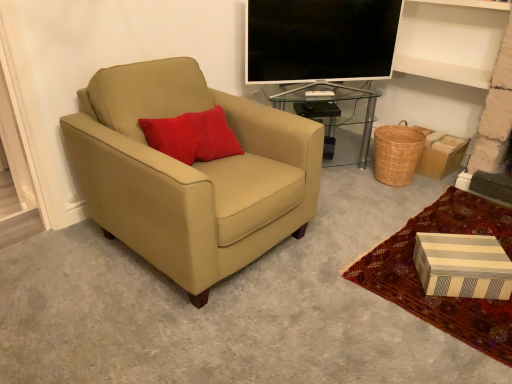
At what (x,y) coordinates should I click in order to perform the action: click on transparent glass table at center. Please return your answer as a coordinate pair (x, y). The width and height of the screenshot is (512, 384). Looking at the image, I should click on (328, 109).

What do you see at coordinates (320, 40) in the screenshot? I see `flat screen tv at upper center` at bounding box center [320, 40].

The image size is (512, 384). Find the location of `beige leather armchair at left`. beige leather armchair at left is located at coordinates (190, 173).

Can you confirm if transparent glass table at center is shorter than woven brown basket at lower right?

In fact, transparent glass table at center may be taller than woven brown basket at lower right.

Do you think transparent glass table at center is within woven brown basket at lower right, or outside of it?

transparent glass table at center is not enclosed by woven brown basket at lower right.

Considering the sizes of objects transparent glass table at center and woven brown basket at lower right in the image provided, who is smaller, transparent glass table at center or woven brown basket at lower right?

With smaller size is woven brown basket at lower right.

Looking at their sizes, would you say transparent glass table at center is wider or thinner than woven brown basket at lower right?

Considering their sizes, transparent glass table at center looks broader than woven brown basket at lower right.

Is the surface of woven brown basket at lower right in direct contact with flat screen tv at upper center?

No, woven brown basket at lower right is not with flat screen tv at upper center.

Is woven brown basket at lower right oriented away from flat screen tv at upper center?

No, woven brown basket at lower right is not facing away from flat screen tv at upper center.

Could flat screen tv at upper center be considered to be inside woven brown basket at lower right?

Actually, flat screen tv at upper center is outside woven brown basket at lower right.

What are the coordinates of `television above the striped cardboard box at lower right (from a real-world perspective)` in the screenshot? It's located at (320, 40).

From the image's perspective, between striped cardboard box at lower right and flat screen tv at upper center, who is located below?

striped cardboard box at lower right appears lower in the image.

Considering the sizes of striped cardboard box at lower right and flat screen tv at upper center in the image, is striped cardboard box at lower right wider or thinner than flat screen tv at upper center?

In the image, striped cardboard box at lower right appears to be wider than flat screen tv at upper center.

Looking at this image, is striped cardboard box at lower right positioned with its back to flat screen tv at upper center?

That's not correct — striped cardboard box at lower right is not looking away from flat screen tv at upper center.

Which object is closer to the camera, striped cardboard box at lower right or woven brown basket at lower right?

Positioned in front is striped cardboard box at lower right.

In terms of width, does striped cardboard box at lower right look wider or thinner when compared to woven brown basket at lower right?

striped cardboard box at lower right is wider than woven brown basket at lower right.

Who is smaller, striped cardboard box at lower right or woven brown basket at lower right?

woven brown basket at lower right.

Is striped cardboard box at lower right facing away from woven brown basket at lower right?

No, striped cardboard box at lower right's orientation is not away from woven brown basket at lower right.

Visually, is woven brown basket at lower right positioned to the left or to the right of striped cardboard box at lower right?

In the image, woven brown basket at lower right appears on the left side of striped cardboard box at lower right.

Which of these two, woven brown basket at lower right or striped cardboard box at lower right, is smaller?

woven brown basket at lower right is smaller.

Locate an element on the screen. The image size is (512, 384). plain located on the right of woven brown basket at lower right is located at coordinates (443, 297).

Considering the points (508, 262) and (486, 200), which point is behind, point (508, 262) or point (486, 200)?

The point (486, 200) is behind.

From the image's perspective, which object appears higher, striped cardboard box at lower right or striped cardboard box at lower right?

striped cardboard box at lower right appears higher in the image.

The width and height of the screenshot is (512, 384). Find the location of `plain on the right of striped cardboard box at lower right`. plain on the right of striped cardboard box at lower right is located at coordinates (443, 297).

Does striped cardboard box at lower right have a larger size compared to striped cardboard box at lower right?

No, striped cardboard box at lower right is not bigger than striped cardboard box at lower right.

Is woven brown basket at lower right looking in the opposite direction of transparent glass table at center?

No.

From the image's perspective, is woven brown basket at lower right located above transparent glass table at center?

No, from the image's perspective, woven brown basket at lower right is not over transparent glass table at center.

Which of these two, woven brown basket at lower right or transparent glass table at center, stands shorter?

Standing shorter between the two is woven brown basket at lower right.

This screenshot has height=384, width=512. Identify the location of table above the woven brown basket at lower right (from the image's perspective). (328, 109).

The image size is (512, 384). I want to click on basket below the flat screen tv at upper center (from the image's perspective), so click(x=397, y=153).

Which object lies further to the anchor point woven brown basket at lower right, transparent glass table at center or beige leather armchair at left?

beige leather armchair at left is positioned further to the anchor woven brown basket at lower right.

Looking at this image, from the image, which object appears to be farther from striped cardboard box at lower right, beige leather armchair at left or striped cardboard box at lower right?

Among the two, beige leather armchair at left is located further to striped cardboard box at lower right.

Which object lies further to the anchor point striped cardboard box at lower right, striped cardboard box at lower right or woven brown basket at lower right?

woven brown basket at lower right is further to striped cardboard box at lower right.

Considering their positions, is striped cardboard box at lower right positioned further to beige leather armchair at left than flat screen tv at upper center?

The object further to beige leather armchair at left is striped cardboard box at lower right.

Considering their positions, is flat screen tv at upper center positioned closer to woven brown basket at lower right than striped cardboard box at lower right?

flat screen tv at upper center is positioned closer to the anchor woven brown basket at lower right.

When comparing their distances from transparent glass table at center, does striped cardboard box at lower right or striped cardboard box at lower right seem further?

striped cardboard box at lower right lies further to transparent glass table at center than the other object.

Considering their positions, is transparent glass table at center positioned further to woven brown basket at lower right than flat screen tv at upper center?

flat screen tv at upper center lies further to woven brown basket at lower right than the other object.

From the image, which object appears to be nearer to flat screen tv at upper center, striped cardboard box at lower right or striped cardboard box at lower right?

The object closer to flat screen tv at upper center is striped cardboard box at lower right.

What are the coordinates of `basket between beige leather armchair at left and transparent glass table at center from front to back` in the screenshot? It's located at point(397,153).

Image resolution: width=512 pixels, height=384 pixels. Identify the location of box between striped cardboard box at lower right and woven brown basket at lower right along the z-axis. (462, 266).

The height and width of the screenshot is (384, 512). I want to click on basket between striped cardboard box at lower right and transparent glass table at center along the z-axis, so click(x=397, y=153).

Where is `basket between flat screen tv at upper center and striped cardboard box at lower right vertically`? The width and height of the screenshot is (512, 384). basket between flat screen tv at upper center and striped cardboard box at lower right vertically is located at coordinates (397, 153).